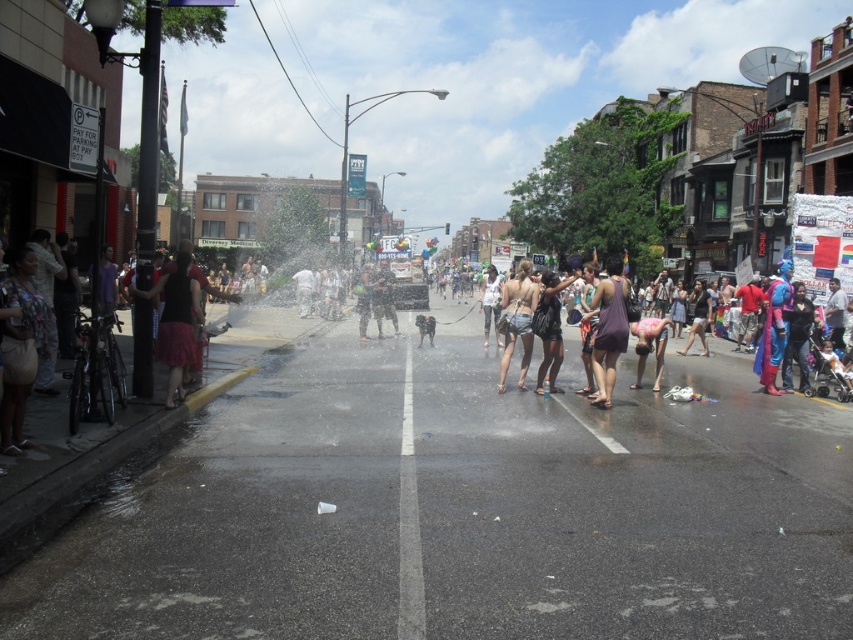
Question: Based on their relative distances, which object is nearer to the dark purple tank top at center?

Choices:
 (A) white cotton tank top at center
 (B) shiny blue costume at center right

Answer: (B)

Question: Can you confirm if shiny blue costume at center right is smaller than matte purple tank top at center?

Choices:
 (A) no
 (B) yes

Answer: (B)

Question: Estimate the real-world distances between objects in this image. Which object is closer to the white cotton tank top at center?

Choices:
 (A) white matte person at center
 (B) denim shorts at center
 (C) matte black shorts at center
 (D) matte purple tank top at center

Answer: (B)

Question: Which object appears farthest from the camera in this image?

Choices:
 (A) denim shorts at center
 (B) white matte person at center
 (C) pink fabric person at center
 (D) matte purple dress at center

Answer: (B)

Question: Can you confirm if denim shorts at center is thinner than shiny blue costume at center right?

Choices:
 (A) yes
 (B) no

Answer: (B)

Question: Is shiny blue costume at center right in front of metallic silver helmet at center?

Choices:
 (A) no
 (B) yes

Answer: (B)